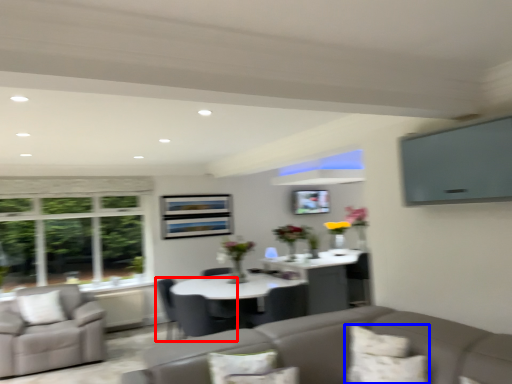
Question: Which of the following is the closest to the observer, chair (highlighted by a red box) or pillow (highlighted by a blue box)?

Choices:
 (A) chair
 (B) pillow

Answer: (B)